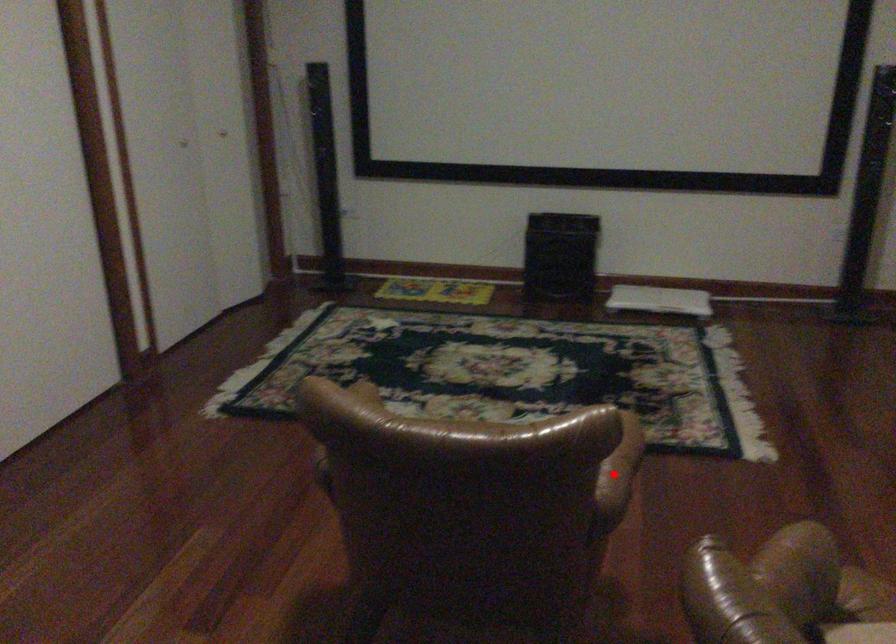
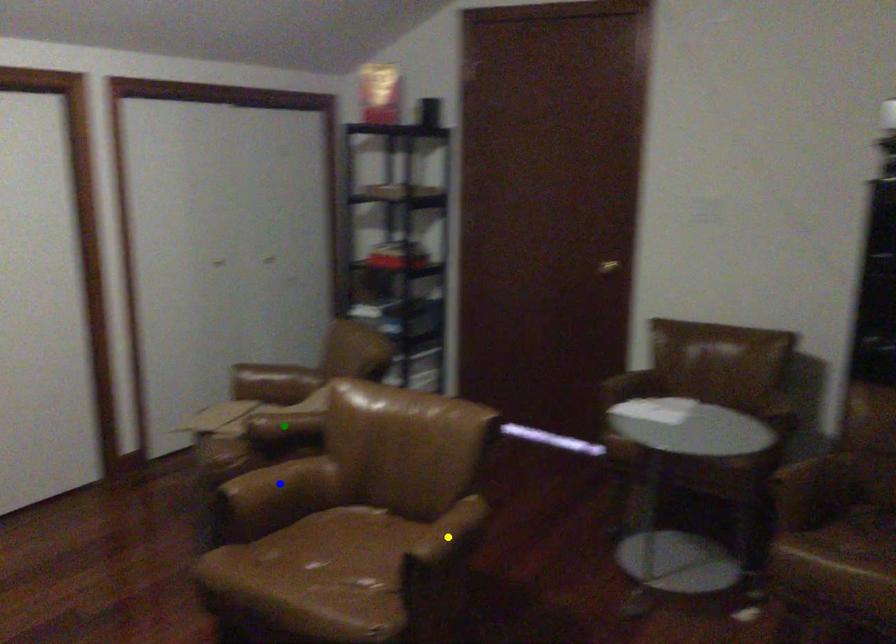
Question: I am providing you with two images of the same scene from different viewpoints. A red point is marked on the first image. You are given multiple points on the second image. Which spot in image 2 lines up with the point in image 1?

Choices:
 (A) yellow point
 (B) blue point
 (C) green point

Answer: (B)